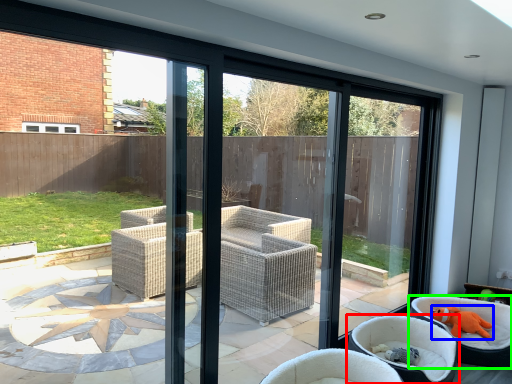
Question: Which object is the farthest from chair (highlighted by a red box)? Choose among these: animal (highlighted by a blue box) or chair (highlighted by a green box).

Choices:
 (A) animal
 (B) chair

Answer: (A)